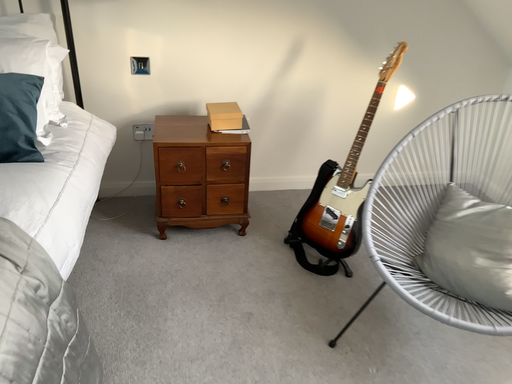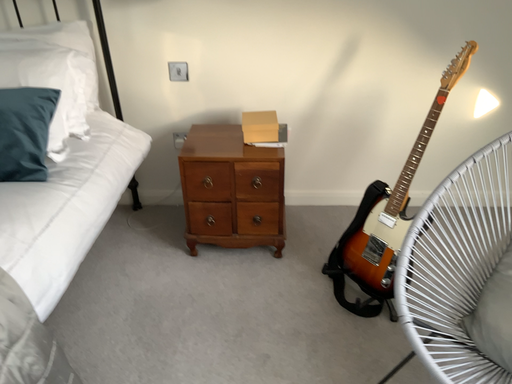
Question: How did the camera likely rotate when shooting the video?

Choices:
 (A) rotated left
 (B) rotated right

Answer: (A)